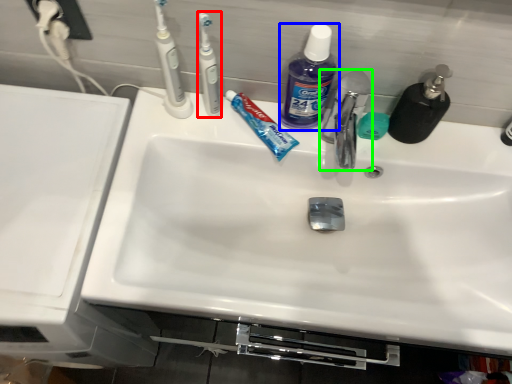
Question: Considering the real-world distances, which object is closest to toothbrush (highlighted by a red box)? cleaning product (highlighted by a blue box) or tap (highlighted by a green box).

Choices:
 (A) cleaning product
 (B) tap

Answer: (A)